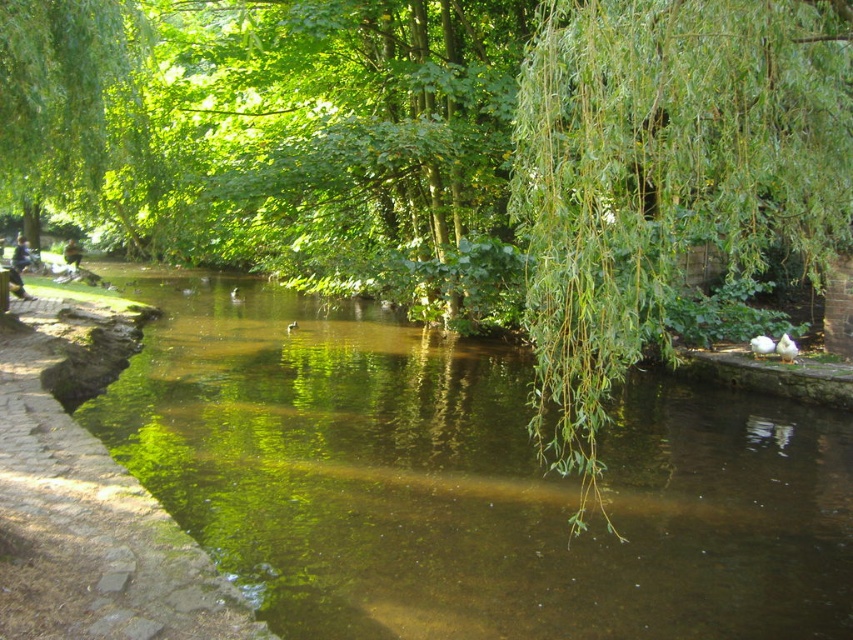
You are standing on the green leafy willow at right and want to walk to the brown stone path at left. Which direction should you move to reach it?

The green leafy willow at right is in front of the brown stone path at left, so you should move backward to reach the brown stone path at left.

You are standing at the edge of the paved pathway on the left side of the river. You want to walk directly to the green reflective water at center. Which direction should you walk to reach it?

To reach the green reflective water at center from the edge of the paved pathway on the left side of the river, you should walk towards the right since the water is located at position point 0.753 on the x axis which is to the right of the pathway.